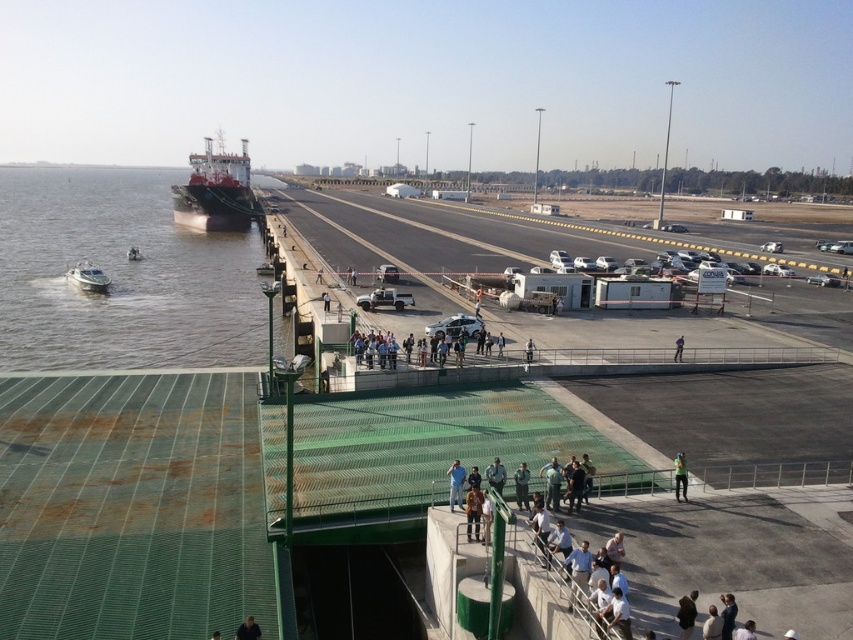
Based on the photo, you are a photographer standing at the port and see two people wearing the dark blue shirt at lower right and the white fabric shirt at lower right. Which person is closer to you?

The dark blue shirt at lower right is closer to you because the white fabric shirt at lower right is behind it.

You are standing at the port and see the brown water at lower left and the white fabric shirt at lower right. Which object is closer to you?

The brown water at lower left is closer to you because it is further to the viewer than the white fabric shirt at lower right.